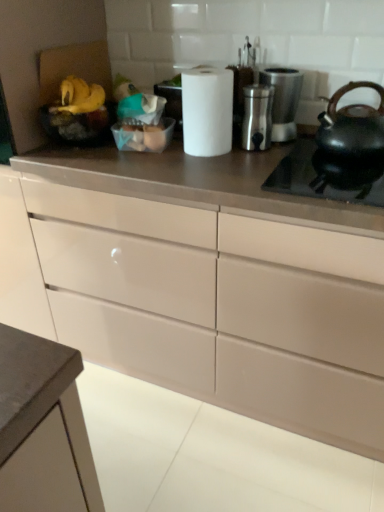
Locate an element on the screen. vacant point above translucent plastic eggs at center, arranged as the 2th food when viewed from the left (from a real-world perspective) is located at coordinates (144, 118).